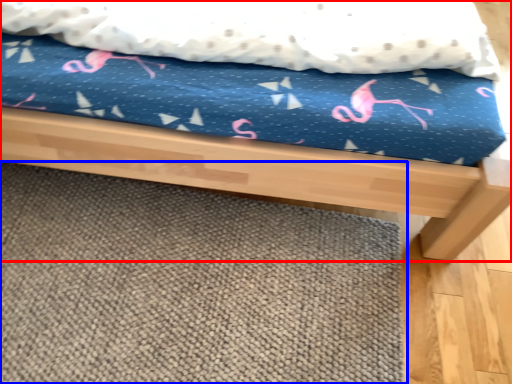
Question: Among these objects, which one is nearest to the camera, bed (highlighted by a red box) or mat (highlighted by a blue box)?

Choices:
 (A) bed
 (B) mat

Answer: (A)